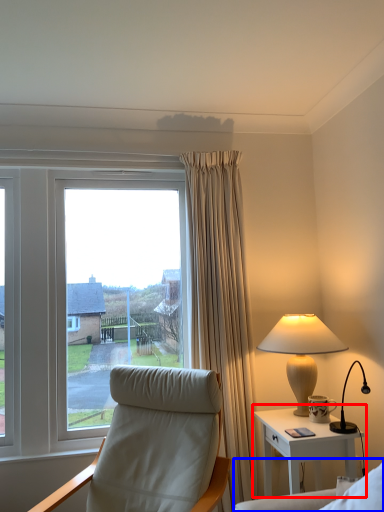
Question: Among these objects, which one is nearest to the camera, nightstand (highlighted by a red box) or couch (highlighted by a blue box)?

Choices:
 (A) nightstand
 (B) couch

Answer: (B)